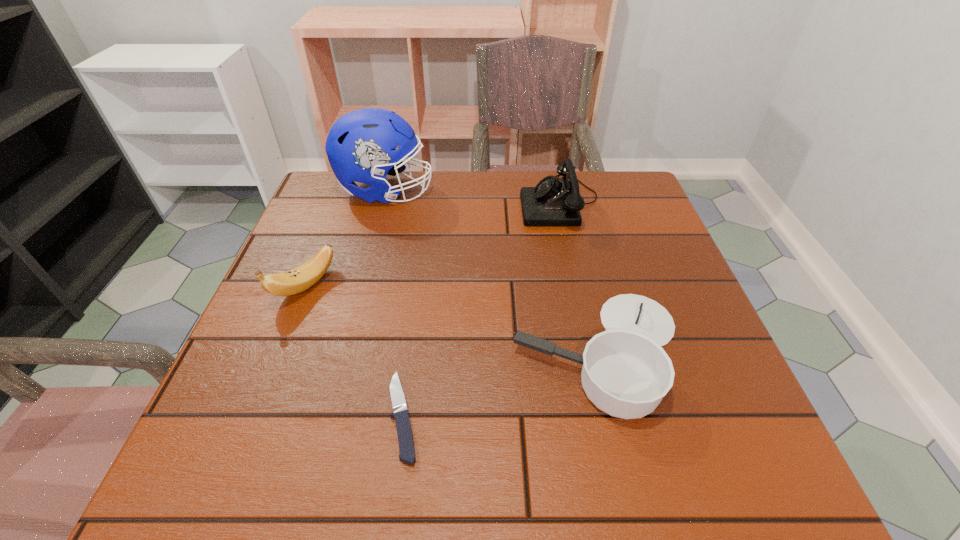
The height and width of the screenshot is (540, 960). In order to click on vacant space situated 0.240m on the left of the saucepan in this screenshot , I will do `click(384, 351)`.

Identify the location of vacant space located 0.190m on the left of the steak knife. (272, 416).

I want to click on football helmet present at the far edge, so click(361, 145).

This screenshot has height=540, width=960. I want to click on telephone present at the far edge, so click(554, 201).

In order to click on object located at the near edge in this screenshot , I will do `click(405, 438)`.

Where is `football helmet present at the left edge`? This screenshot has width=960, height=540. football helmet present at the left edge is located at coordinates (361, 145).

You are a GUI agent. You are given a task and a screenshot of the screen. Output one action in this format:
    pyautogui.click(x=<x>, y=<y>)
    Task: Click on the banana positioned at the left edge
    
    Given the screenshot: What is the action you would take?
    pyautogui.click(x=299, y=279)

The width and height of the screenshot is (960, 540). I want to click on telephone at the right edge, so click(x=554, y=201).

Find the location of a particular element. This screenshot has height=540, width=960. saucepan that is at the right edge is located at coordinates (626, 373).

Identify the location of object that is at the far left corner. This screenshot has height=540, width=960. (361, 145).